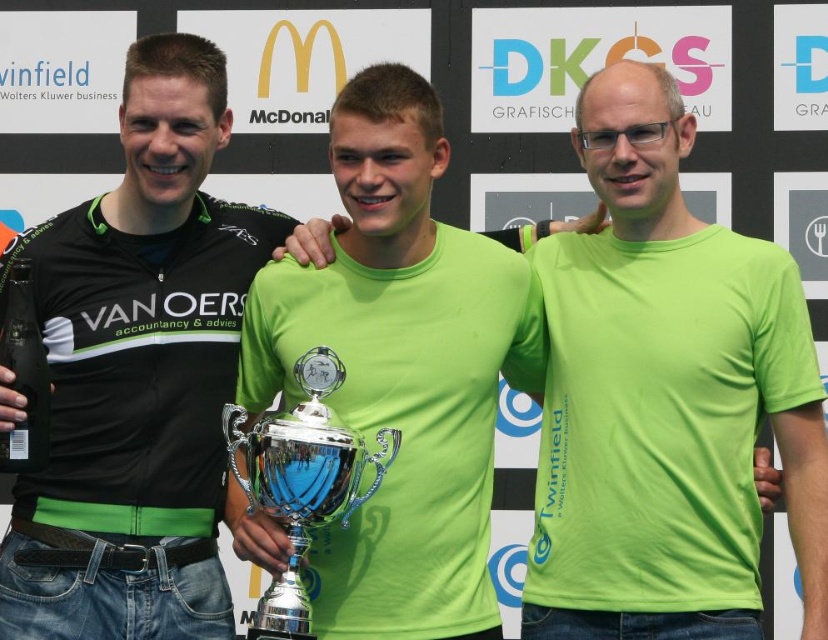
Question: Does black jersey at left have a lesser width compared to neon green t-shirt at center?

Choices:
 (A) yes
 (B) no

Answer: (B)

Question: Does neon green t-shirt at center have a larger size compared to silver shiny trophy at center?

Choices:
 (A) no
 (B) yes

Answer: (B)

Question: Among these points, which one is nearest to the camera?

Choices:
 (A) (34, 477)
 (B) (564, 573)
 (C) (287, 474)

Answer: (C)

Question: Estimate the real-world distances between objects in this image. Which object is farther from the neon green t-shirt at center?

Choices:
 (A) silver shiny trophy at center
 (B) black jersey at left

Answer: (B)

Question: Which object is the farthest from the black jersey at left?

Choices:
 (A) neon green t-shirt at center
 (B) silver shiny trophy at center

Answer: (A)

Question: Is black jersey at left closer to the viewer compared to silver shiny trophy at center?

Choices:
 (A) no
 (B) yes

Answer: (A)